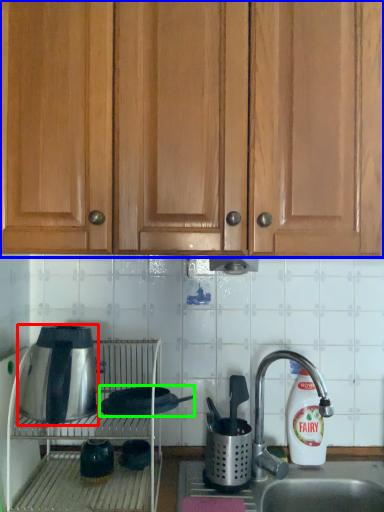
Question: Estimate the real-world distances between objects in this image. Which object is closer to kitchen appliance (highlighted by a red box), cabinetry (highlighted by a blue box) or appliance (highlighted by a green box)?

Choices:
 (A) cabinetry
 (B) appliance

Answer: (B)